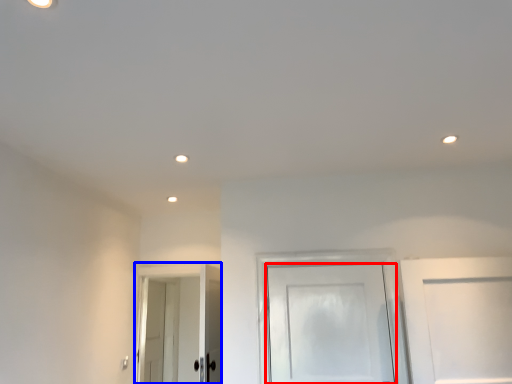
Question: Which point is closer to the camera, door (highlighted by a red box) or door (highlighted by a blue box)?

Choices:
 (A) door
 (B) door

Answer: (A)